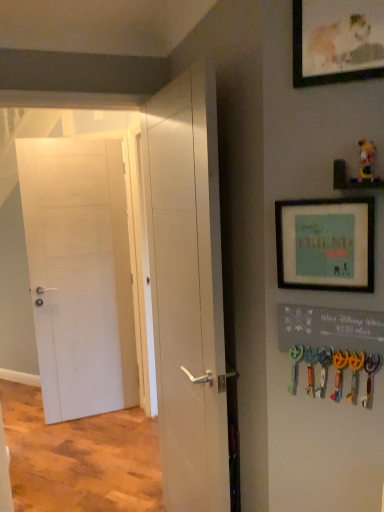
Question: Does point coord(49,236) appear closer or farther from the camera than point coord(329,244)?

Choices:
 (A) farther
 (B) closer

Answer: (A)

Question: Would you say white matte door at left, which is counted as the first door, starting from the back, is to the left or to the right of teal matte picture frame at upper right, which appears as the second picture frame when viewed from the top, in the picture?

Choices:
 (A) left
 (B) right

Answer: (A)

Question: Which object is positioned closest to the white matte door at center, which is the second door in left-to-right order?

Choices:
 (A) teal matte picture frame at upper right, the 1th picture frame from the bottom
 (B) matte wooden picture frame at upper right, which is the 1th picture frame from top to bottom
 (C) plush yellow bear at upper right
 (D) white matte door at left, the 2th door viewed from the right

Answer: (A)

Question: Based on their relative distances, which object is nearer to the teal matte picture frame at upper right, which appears as the second picture frame when viewed from the top?

Choices:
 (A) matte wooden picture frame at upper right, positioned as the second picture frame in bottom-to-top order
 (B) white matte door at left, which is counted as the first door, starting from the back
 (C) plush yellow bear at upper right
 (D) white matte door at center, which is the second door in left-to-right order

Answer: (C)